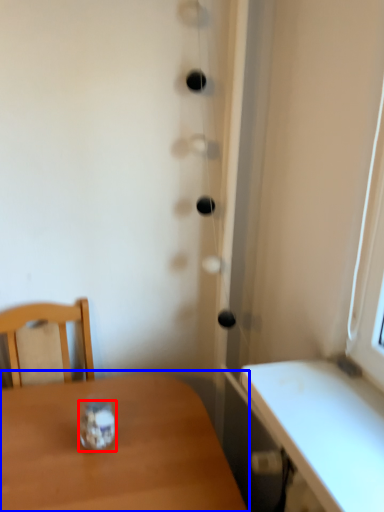
Question: Among these objects, which one is nearest to the camera, glass jar (highlighted by a red box) or table (highlighted by a blue box)?

Choices:
 (A) glass jar
 (B) table

Answer: (B)